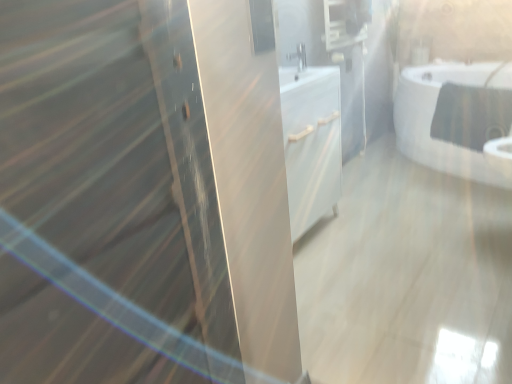
Question: Looking at their shapes, would you say white glossy bathtub at upper right is wider or thinner than satin nickel faucet at center?

Choices:
 (A) wide
 (B) thin

Answer: (A)

Question: In the image, is white glossy bathtub at upper right on the left side or the right side of satin nickel faucet at center?

Choices:
 (A) right
 (B) left

Answer: (A)

Question: Based on their relative distances, which object is nearer to the matte black medicine cabinet at upper center?

Choices:
 (A) satin nickel faucet at center
 (B) white glossy bathtub at upper right

Answer: (A)

Question: Based on their relative distances, which object is farther from the satin nickel faucet at center?

Choices:
 (A) white glossy bathtub at upper right
 (B) matte black medicine cabinet at upper center

Answer: (A)